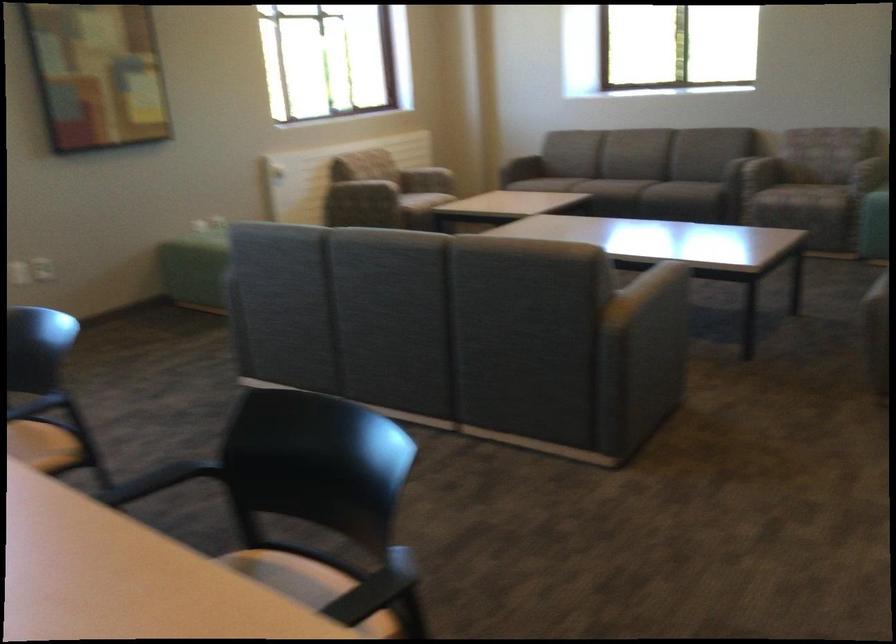
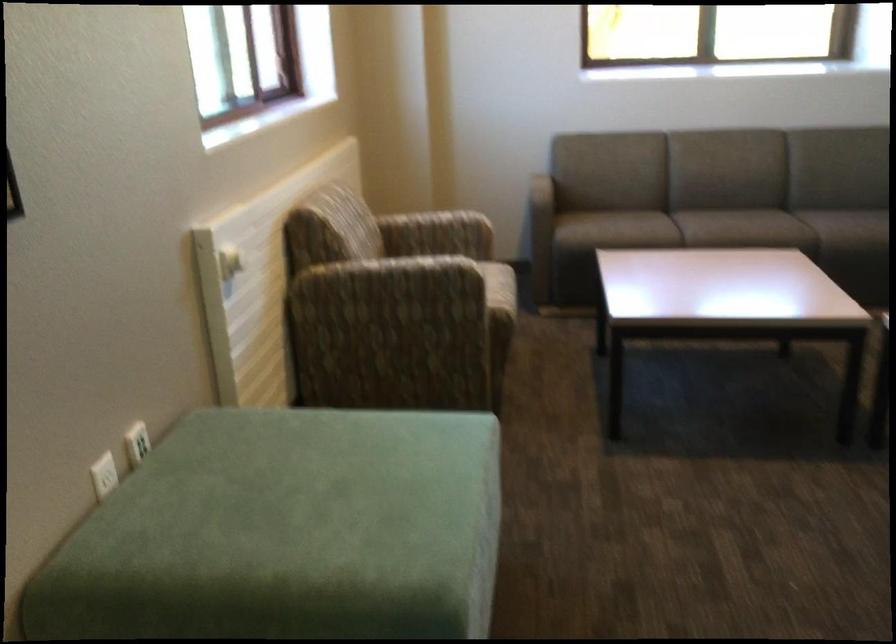
Question: I am providing you with two images of the same scene from different viewpoints. After the viewpoint changes to image2, which objects are now occluded?

Choices:
 (A) white power outlet
 (B) patterned chair sitting surface
 (C) white radiator knob
 (D) none of these

Answer: (D)